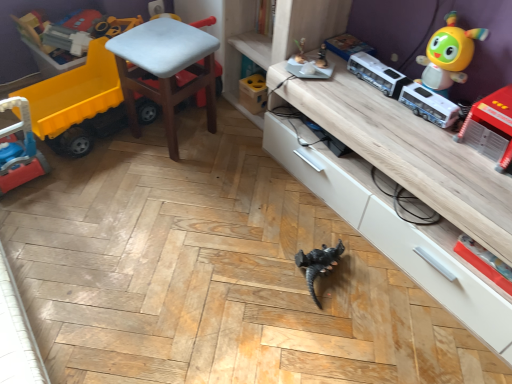
You are a GUI agent. You are given a task and a screenshot of the screen. Output one action in this format:
    pyautogui.click(x=<x>, y=<y>)
    Task: Click on the free area below white plastic bus at upper right (from a real-world perspective)
    
    Given the screenshot: What is the action you would take?
    pyautogui.click(x=397, y=96)